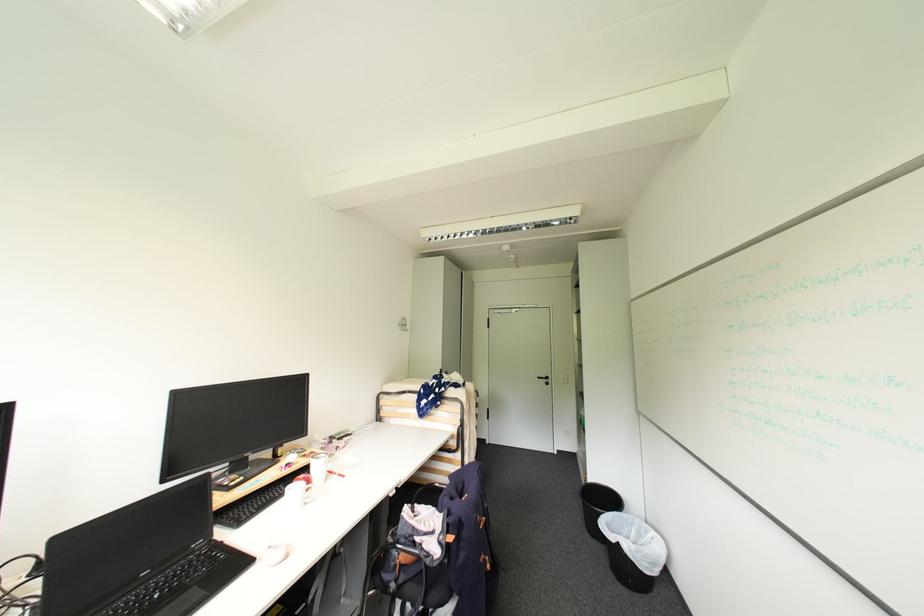
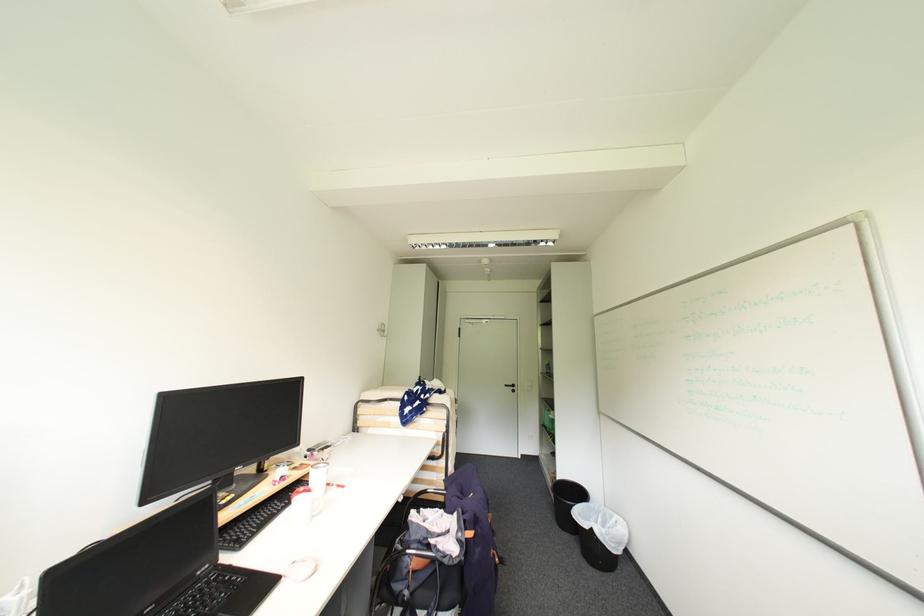
In the second image, find the point that corresponds to point 624,514 in the first image.

(591, 505)